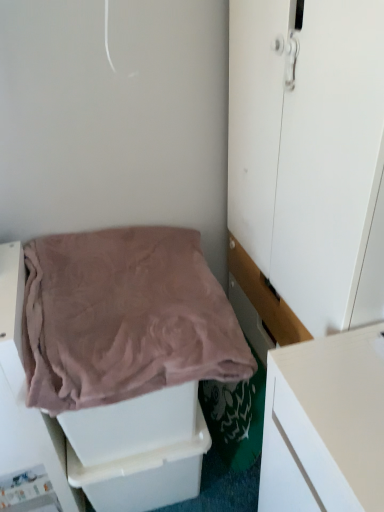
The image size is (384, 512). What do you see at coordinates (144, 475) in the screenshot? I see `white plastic drawer at lower center` at bounding box center [144, 475].

Identify the location of white matte door at center. The image size is (384, 512). (310, 153).

Based on the photo, is pink soft fabric at lower left further to camera compared to white matte door at center?

Yes.

Between pink soft fabric at lower left and white matte door at center, which one has larger size?

Bigger between the two is white matte door at center.

Is pink soft fabric at lower left positioned far away from white matte door at center?

No, pink soft fabric at lower left is in close proximity to white matte door at center.

Is pink soft fabric at lower left at the back of white matte door at center?

That's right, white matte door at center is facing away from pink soft fabric at lower left.

Is white matte door at center bigger or smaller than pink soft fabric at lower left?

Considering their sizes, white matte door at center takes up more space than pink soft fabric at lower left.

Can you see white matte door at center touching pink soft fabric at lower left?

No, white matte door at center is not next to pink soft fabric at lower left.

Who is taller, white matte door at center or pink soft fabric at lower left?

With more height is white matte door at center.

From a real-world perspective, relative to pink soft fabric at lower left, is white plastic drawer at lower center vertically above or below?

white plastic drawer at lower center is situated lower than pink soft fabric at lower left in the real world.

Considering the positions of objects white plastic drawer at lower center and pink soft fabric at lower left in the image provided, who is more to the right, white plastic drawer at lower center or pink soft fabric at lower left?

white plastic drawer at lower center is more to the right.

Can you tell me how much white plastic drawer at lower center and pink soft fabric at lower left differ in facing direction?

white plastic drawer at lower center and pink soft fabric at lower left are facing 0.835 degrees away from each other.

Based on the photo, from the image's perspective, would you say white plastic drawer at lower center is shown under pink soft fabric at lower left?

Yes.

Can you tell me how much white matte door at center and white plastic drawer at lower center differ in facing direction?

91 degrees separate the facing orientations of white matte door at center and white plastic drawer at lower center.

From a real-world perspective, is white matte door at center located beneath white plastic drawer at lower center?

No.

Is white matte door at center bigger than white plastic drawer at lower center?

Correct, white matte door at center is larger in size than white plastic drawer at lower center.

Could white plastic drawer at lower center be considered to be inside pink soft fabric at lower left?

No, white plastic drawer at lower center is not a part of pink soft fabric at lower left.

Measure the distance between pink soft fabric at lower left and white plastic drawer at lower center.

pink soft fabric at lower left is 15.64 inches from white plastic drawer at lower center.

From their relative heights in the image, would you say pink soft fabric at lower left is taller or shorter than white plastic drawer at lower center?

Clearly, pink soft fabric at lower left is shorter compared to white plastic drawer at lower center.

Does pink soft fabric at lower left come in front of white plastic drawer at lower center?

Yes, it is in front of white plastic drawer at lower center.

From a real-world perspective, does white plastic drawer at lower center sit lower than white matte door at center?

Yes.

Which of these two, white plastic drawer at lower center or white matte door at center, is bigger?

Bigger between the two is white matte door at center.

Between white plastic drawer at lower center and white matte door at center, which one has more height?

Standing taller between the two is white matte door at center.

Locate an element on the screen. Image resolution: width=384 pixels, height=512 pixels. blanket above the white matte door at center (from a real-world perspective) is located at coordinates (124, 318).

Identify the location of door lying on the right of pink soft fabric at lower left. This screenshot has height=512, width=384. (310, 153).

Looking at the image, which one is located further to white plastic drawer at lower center, pink soft fabric at lower left or white matte door at center?

Based on the image, white matte door at center appears to be further to white plastic drawer at lower center.

Based on their spatial positions, is white plastic drawer at lower center or pink soft fabric at lower left closer to white matte door at center?

pink soft fabric at lower left is closer to white matte door at center.

Considering their positions, is white matte door at center positioned further to white plastic drawer at lower center than pink soft fabric at lower left?

The object further to white plastic drawer at lower center is white matte door at center.

Based on their spatial positions, is white matte door at center or white plastic drawer at lower center closer to pink soft fabric at lower left?

white matte door at center.

Considering their positions, is white plastic drawer at lower center positioned closer to pink soft fabric at lower left than white matte door at center?

Based on the image, white matte door at center appears to be nearer to pink soft fabric at lower left.

From the image, which object appears to be farther from white matte door at center, pink soft fabric at lower left or white plastic drawer at lower center?

Based on the image, white plastic drawer at lower center appears to be further to white matte door at center.

Where is `drawer between pink soft fabric at lower left and white matte door at center from left to right`? Image resolution: width=384 pixels, height=512 pixels. drawer between pink soft fabric at lower left and white matte door at center from left to right is located at coordinates tap(144, 475).